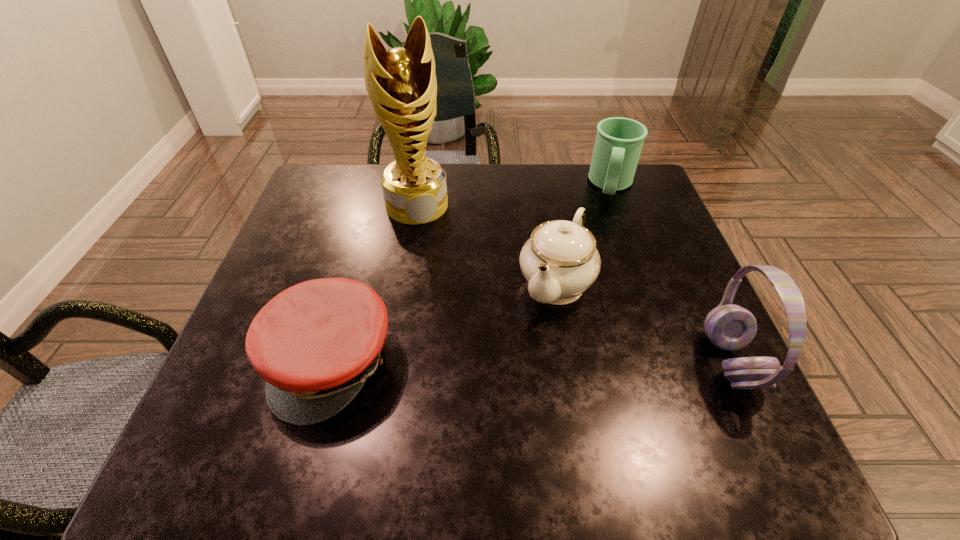
The width and height of the screenshot is (960, 540). Find the location of `the fourth closest object to the mug`. the fourth closest object to the mug is located at coordinates (316, 343).

Locate which object is the third closest to the fourth shortest object. Please provide its 2D coordinates. Your answer should be formatted as a tuple, i.e. [(x, y)], where the tuple contains the x and y coordinates of a point satisfying the conditions above.

[(316, 343)]

Find the location of a particular element. free space that satisfies the following two spatial constraints: 1. on the front side of the tallest object; 2. on the headband and ear cups of the fourth shortest object is located at coordinates (392, 362).